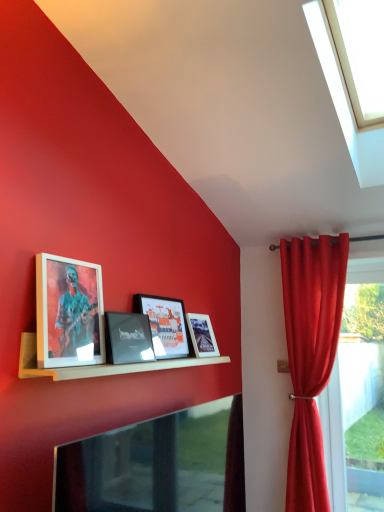
Question: From the image's perspective, is transparent glass window at upper right beneath matte glass picture frame at center, marked as the third picture frame in a front-to-back arrangement?

Choices:
 (A) yes
 (B) no

Answer: (B)

Question: Is the depth of transparent glass window at upper right less than that of matte glass picture frame at center, marked as the third picture frame in a front-to-back arrangement?

Choices:
 (A) no
 (B) yes

Answer: (B)

Question: Is transparent glass window at upper right aimed at matte glass picture frame at center, which is the second picture frame from back to front?

Choices:
 (A) yes
 (B) no

Answer: (B)

Question: From the image's perspective, is transparent glass window at upper right located above matte glass picture frame at center, marked as the third picture frame in a front-to-back arrangement?

Choices:
 (A) no
 (B) yes

Answer: (B)

Question: Is transparent glass window at upper right to the left of matte glass picture frame at center, marked as the third picture frame in a front-to-back arrangement, from the viewer's perspective?

Choices:
 (A) yes
 (B) no

Answer: (B)

Question: From a real-world perspective, is velvet red curtain at right above or below metallic glossy tv at lower center?

Choices:
 (A) above
 (B) below

Answer: (A)

Question: Is point (329, 278) closer or farther from the camera than point (150, 458)?

Choices:
 (A) farther
 (B) closer

Answer: (A)

Question: Looking at the image, does velvet red curtain at right seem bigger or smaller compared to metallic glossy tv at lower center?

Choices:
 (A) small
 (B) big

Answer: (B)

Question: Looking at their shapes, would you say velvet red curtain at right is wider or thinner than metallic glossy tv at lower center?

Choices:
 (A) wide
 (B) thin

Answer: (A)

Question: Looking at their shapes, would you say metallic glossy tv at lower center is wider or thinner than velvet red curtain at right?

Choices:
 (A) thin
 (B) wide

Answer: (A)

Question: Considering the positions of point (170, 414) and point (311, 465), is point (170, 414) closer or farther from the camera than point (311, 465)?

Choices:
 (A) closer
 (B) farther

Answer: (A)

Question: From a real-world perspective, is metallic glossy tv at lower center physically located above or below velvet red curtain at right?

Choices:
 (A) above
 (B) below

Answer: (B)

Question: Looking at the image, does metallic glossy tv at lower center seem bigger or smaller compared to velvet red curtain at right?

Choices:
 (A) big
 (B) small

Answer: (B)

Question: Relative to matte white picture frame at center, which appears as the 4th picture frame when viewed from the front, is metallic glossy tv at lower center in front or behind?

Choices:
 (A) front
 (B) behind

Answer: (A)

Question: Based on their positions, is metallic glossy tv at lower center located to the left or right of matte white picture frame at center, which appears as the 4th picture frame when viewed from the front?

Choices:
 (A) left
 (B) right

Answer: (A)